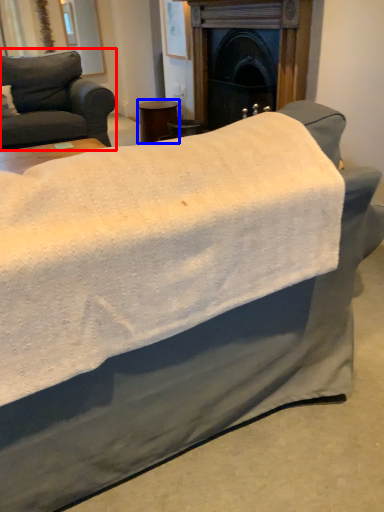
Question: Which object appears farthest to the camera in this image, studio couch (highlighted by a red box) or side table (highlighted by a blue box)?

Choices:
 (A) studio couch
 (B) side table

Answer: (B)